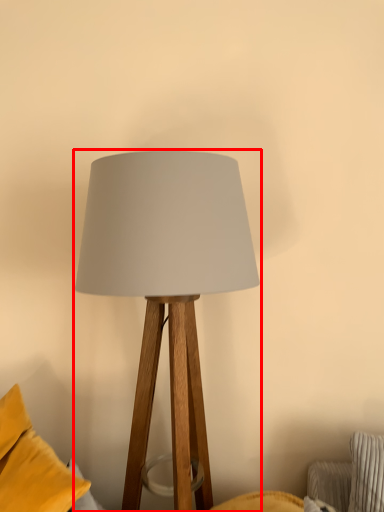
Question: From the image, what is the correct spatial relationship of lamp (annotated by the red box) in relation to pillow?

Choices:
 (A) right
 (B) left

Answer: (A)